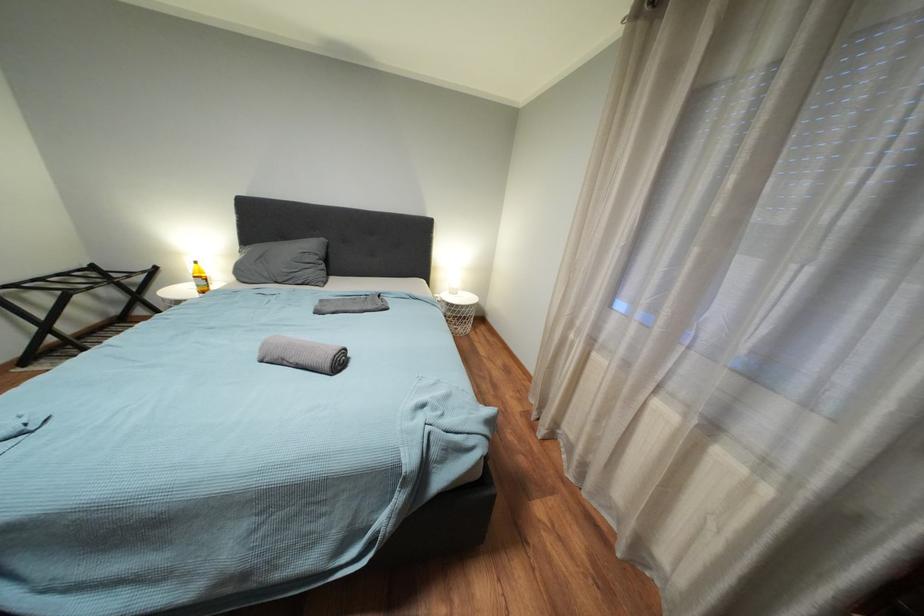
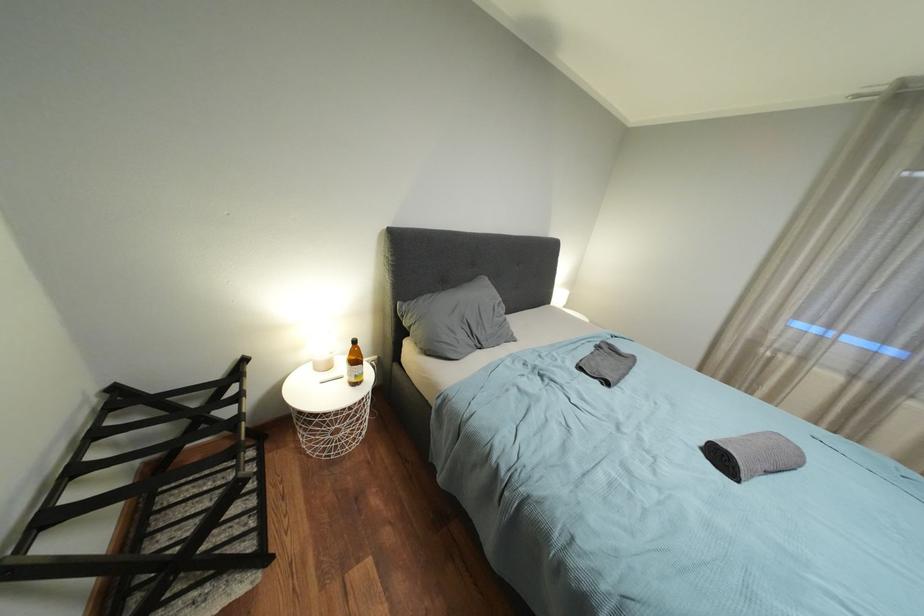
Question: The images are taken continuously from a first-person perspective. In which direction are you moving?

Choices:
 (A) Left
 (B) Right
 (C) Forward
 (D) Backward

Answer: (A)